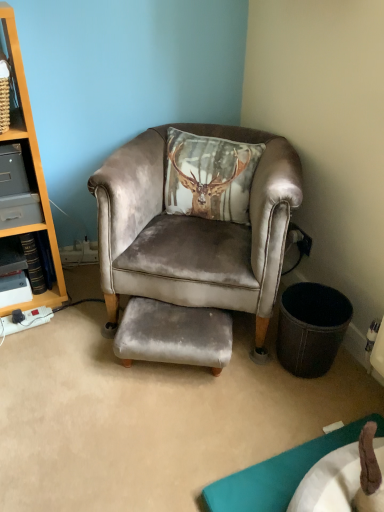
Question: Does gray plastic drawer at left have a greater width compared to velvet grey footrest at center?

Choices:
 (A) no
 (B) yes

Answer: (B)

Question: Is gray plastic drawer at left facing away from velvet grey footrest at center?

Choices:
 (A) yes
 (B) no

Answer: (B)

Question: From a real-world perspective, is gray plastic drawer at left on velvet grey footrest at center?

Choices:
 (A) no
 (B) yes

Answer: (B)

Question: From the image's perspective, is gray plastic drawer at left on top of velvet grey footrest at center?

Choices:
 (A) no
 (B) yes

Answer: (B)

Question: Is gray plastic drawer at left located outside velvet grey footrest at center?

Choices:
 (A) no
 (B) yes

Answer: (B)

Question: From the image's perspective, is gray plastic drawer at left under velvet grey footrest at center?

Choices:
 (A) yes
 (B) no

Answer: (B)

Question: Is velvet grey chair at center closer to camera compared to velvet grey footrest at center?

Choices:
 (A) no
 (B) yes

Answer: (B)

Question: Is velvet grey chair at center thinner than velvet grey footrest at center?

Choices:
 (A) no
 (B) yes

Answer: (A)

Question: Is velvet grey chair at center located outside velvet grey footrest at center?

Choices:
 (A) no
 (B) yes

Answer: (B)

Question: Can you confirm if velvet grey chair at center is positioned to the right of velvet grey footrest at center?

Choices:
 (A) yes
 (B) no

Answer: (A)

Question: From a real-world perspective, is velvet grey chair at center over velvet grey footrest at center?

Choices:
 (A) yes
 (B) no

Answer: (A)

Question: Is velvet grey chair at center turned away from velvet grey footrest at center?

Choices:
 (A) yes
 (B) no

Answer: (B)

Question: Is velvet grey chair at center at the back of velvet grey footrest at center?

Choices:
 (A) no
 (B) yes

Answer: (B)